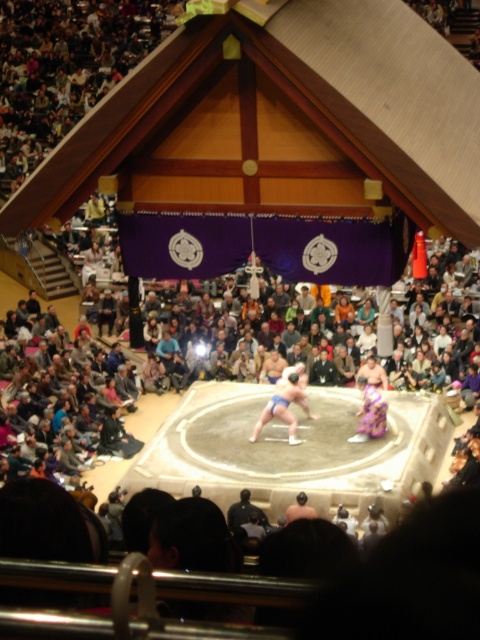
You are a sumo referee standing at the edge of the dohyo. You need to place a new 1.5 meter wide equipment box between the blue fabric sumo at center and the dark blue fabric kimono at center. Can the box fit between them?

The blue fabric sumo at center is wider than the dark blue fabric kimono at center. Since the equipment box is 1.5 meters wide, it depends on the available space between them. However, the description only states the relative sizes of the objects, not the distance between them. Without knowing the exact distance between the two objects, it is impossible to determine if the box will fit.

You are a photographer positioned at the back of the arena. You want to take a photo of the blue fabric sumo at center and the dark blue fabric kimono at center. Which object will appear larger in your photo?

The blue fabric sumo at center will appear larger in the photo because it is much taller than the dark blue fabric kimono at center.

You are a photographer positioned at the back of the arena. You want to capture a clear photo of the dark blue fabric kimono at center without the blue fabric sumo at center blocking it. Is this possible?

The blue fabric sumo at center is positioned over the dark blue fabric kimono at center, so it will block the view. Therefore, it is not possible to capture a clear photo of the dark blue fabric kimono at center without the blue fabric sumo at center blocking it.